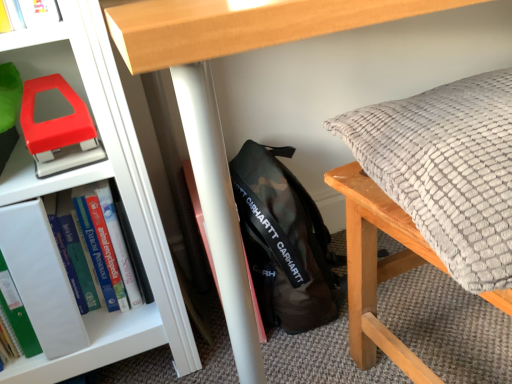
Where is `hardcover book at left`? This screenshot has width=512, height=384. hardcover book at left is located at coordinates (50, 283).

Describe the element at coordinates (47, 63) in the screenshot. The height and width of the screenshot is (384, 512). I see `matte plastic stapler at left` at that location.

This screenshot has height=384, width=512. In order to click on camo fabric backpack at center in this screenshot , I will do `click(283, 241)`.

The height and width of the screenshot is (384, 512). I want to click on hardcover book at left, so click(x=50, y=283).

Which of these two, textured gray pillow at right or camo fabric backpack at center, is smaller?

With smaller size is camo fabric backpack at center.

Does point (482, 80) come in front of point (265, 263)?

Yes, it is.

Considering the relative positions of textured gray pillow at right and matte plastic stapler at left in the image provided, is textured gray pillow at right to the right of matte plastic stapler at left from the viewer's perspective?

Yes, textured gray pillow at right is to the right of matte plastic stapler at left.

Is textured gray pillow at right with matte plastic stapler at left?

No.

Is textured gray pillow at right wider or thinner than matte plastic stapler at left?

Considering their sizes, textured gray pillow at right looks broader than matte plastic stapler at left.

This screenshot has height=384, width=512. Find the location of `shelf that is above the textured gray pillow at right (from a real-world perspective)`. shelf that is above the textured gray pillow at right (from a real-world perspective) is located at coordinates (47, 63).

Is camo fabric backpack at center inside or outside of textured gray pillow at right?

camo fabric backpack at center is located beyond the bounds of textured gray pillow at right.

The width and height of the screenshot is (512, 384). I want to click on pillow above the camo fabric backpack at center (from the image's perspective), so click(x=446, y=170).

Which of these two, camo fabric backpack at center or textured gray pillow at right, is smaller?

camo fabric backpack at center.

Between camo fabric backpack at center and matte plastic stapler at left, which one has smaller width?

Thinner between the two is matte plastic stapler at left.

Does camo fabric backpack at center appear on the right side of matte plastic stapler at left?

Yes, camo fabric backpack at center is to the right of matte plastic stapler at left.

Could you tell me if camo fabric backpack at center is turned towards matte plastic stapler at left?

No, camo fabric backpack at center is not oriented towards matte plastic stapler at left.

Which object is closer to the camera, matte plastic stapler at left or textured gray pillow at right?

textured gray pillow at right.

How many degrees apart are the facing directions of matte plastic stapler at left and textured gray pillow at right?

The facing directions of matte plastic stapler at left and textured gray pillow at right are 177 degrees apart.

Can you confirm if matte plastic stapler at left is bigger than textured gray pillow at right?

Actually, matte plastic stapler at left might be smaller than textured gray pillow at right.

Is textured gray pillow at right completely or partially inside matte plastic stapler at left?

Actually, textured gray pillow at right is outside matte plastic stapler at left.

Is textured gray pillow at right shorter than hardcover book at left?

Yes, textured gray pillow at right is shorter than hardcover book at left.

Based on their sizes in the image, would you say textured gray pillow at right is bigger or smaller than hardcover book at left?

In the image, textured gray pillow at right appears to be larger than hardcover book at left.

What's the angular difference between textured gray pillow at right and hardcover book at left's facing directions?

179 degrees.

From the image's perspective, is matte plastic stapler at left positioned above or below camo fabric backpack at center?

Clearly, from the image's perspective, matte plastic stapler at left is above camo fabric backpack at center.

Is matte plastic stapler at left directly adjacent to camo fabric backpack at center?

No, matte plastic stapler at left is not beside camo fabric backpack at center.

Is matte plastic stapler at left smaller than camo fabric backpack at center?

Indeed, matte plastic stapler at left has a smaller size compared to camo fabric backpack at center.

Can you confirm if matte plastic stapler at left is shorter than camo fabric backpack at center?

Yes, matte plastic stapler at left is shorter than camo fabric backpack at center.

Where is `pillow in front of the camo fabric backpack at center`? Image resolution: width=512 pixels, height=384 pixels. pillow in front of the camo fabric backpack at center is located at coordinates (446, 170).

In the image, there is a matte plastic stapler at left. Identify the location of pillow below it (from the image's perspective). Image resolution: width=512 pixels, height=384 pixels. (446, 170).

Estimate the real-world distances between objects in this image. Which object is further from hardcover book at left, matte plastic stapler at left or camo fabric backpack at center?

Based on the image, camo fabric backpack at center appears to be further to hardcover book at left.

When comparing their distances from hardcover book at left, does camo fabric backpack at center or matte plastic stapler at left seem further?

camo fabric backpack at center is positioned further to the anchor hardcover book at left.

Which object lies further to the anchor point camo fabric backpack at center, textured gray pillow at right or matte plastic stapler at left?

matte plastic stapler at left is positioned further to the anchor camo fabric backpack at center.

When comparing their distances from matte plastic stapler at left, does hardcover book at left or textured gray pillow at right seem closer?

Among the two, hardcover book at left is located nearer to matte plastic stapler at left.

Which object lies further to the anchor point hardcover book at left, camo fabric backpack at center or textured gray pillow at right?

Based on the image, textured gray pillow at right appears to be further to hardcover book at left.

Looking at the image, which one is located further to textured gray pillow at right, hardcover book at left or matte plastic stapler at left?

Among the two, hardcover book at left is located further to textured gray pillow at right.

Based on their spatial positions, is hardcover book at left or camo fabric backpack at center closer to matte plastic stapler at left?

hardcover book at left.

Estimate the real-world distances between objects in this image. Which object is closer to camo fabric backpack at center, matte plastic stapler at left or hardcover book at left?

hardcover book at left.

This screenshot has width=512, height=384. Identify the location of shelf located between hardcover book at left and camo fabric backpack at center in the left-right direction. (47, 63).

Image resolution: width=512 pixels, height=384 pixels. What are the coordinates of `shelf situated between hardcover book at left and textured gray pillow at right from left to right` in the screenshot? It's located at (47, 63).

Where is `backpack between hardcover book at left and textured gray pillow at right`? backpack between hardcover book at left and textured gray pillow at right is located at coordinates (283, 241).

The width and height of the screenshot is (512, 384). What are the coordinates of `backpack located between matte plastic stapler at left and textured gray pillow at right in the left-right direction` in the screenshot? It's located at (283, 241).